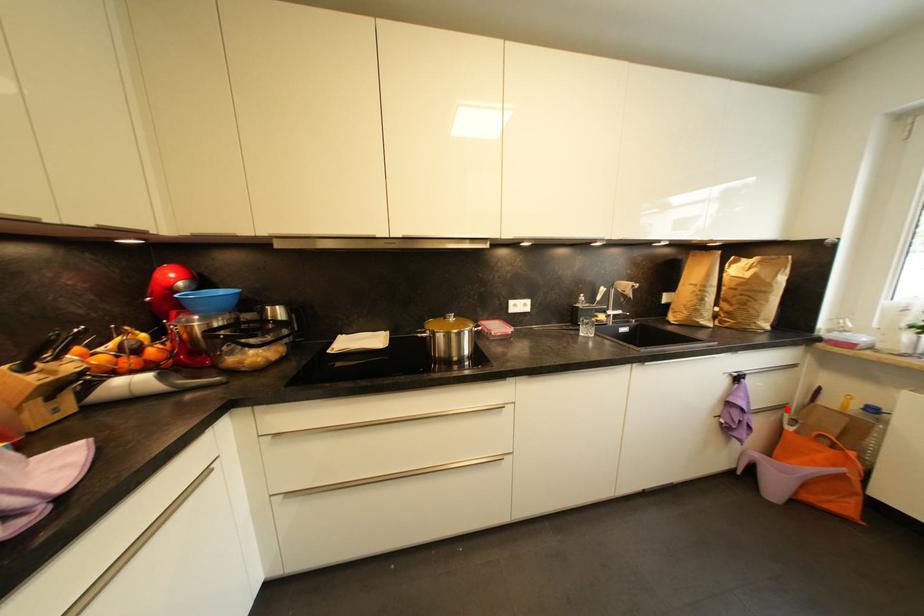
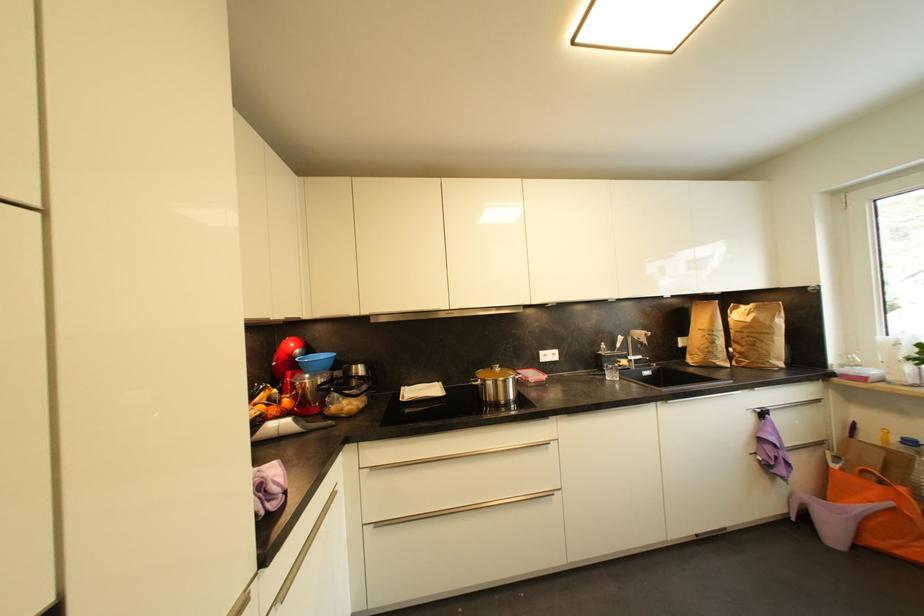
Find the pixel in the second image that matches the highlighted location in the first image.

(825, 446)